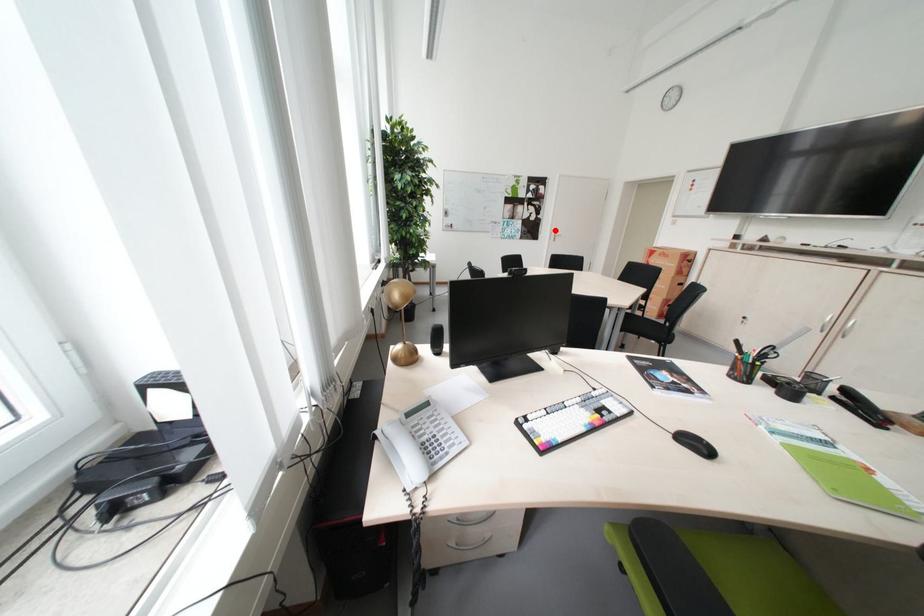
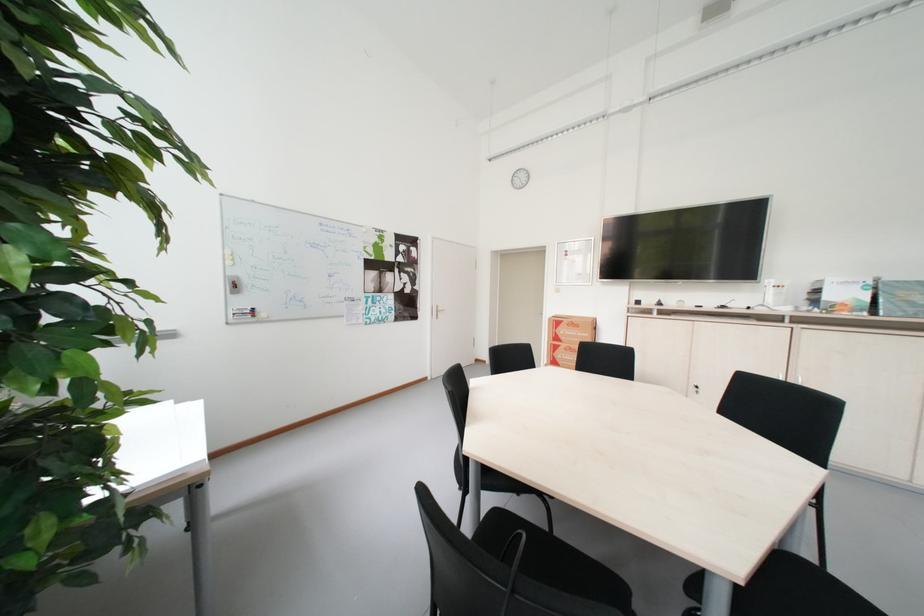
Where in the second image is the point corresponding to the highlighted location from the first image?

(434, 305)